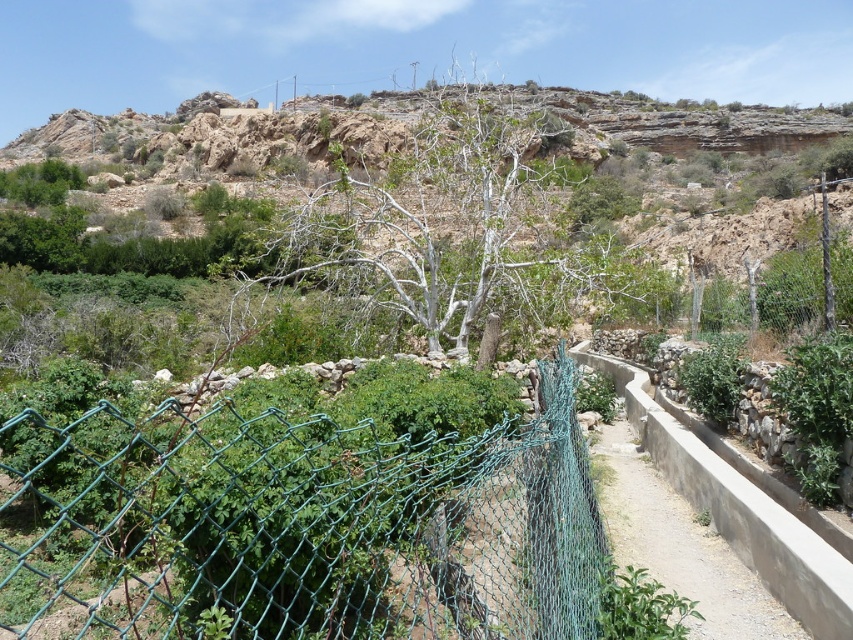
Question: Which object is the closest to the gray concrete path at center?

Choices:
 (A) green chain-link fence at center
 (B) bare wood tree at center

Answer: (A)

Question: Which object is farther from the camera taking this photo?

Choices:
 (A) gray concrete path at center
 (B) green chain-link fence at center
 (C) bare wood tree at center

Answer: (C)

Question: Is green chain-link fence at center closer to the viewer compared to gray concrete path at center?

Choices:
 (A) yes
 (B) no

Answer: (A)

Question: Which point is farther to the camera?

Choices:
 (A) (547, 134)
 (B) (13, 464)
 (C) (706, 564)

Answer: (A)

Question: Is green chain-link fence at center above bare wood tree at center?

Choices:
 (A) yes
 (B) no

Answer: (B)

Question: Is green chain-link fence at center bigger than bare wood tree at center?

Choices:
 (A) no
 (B) yes

Answer: (A)